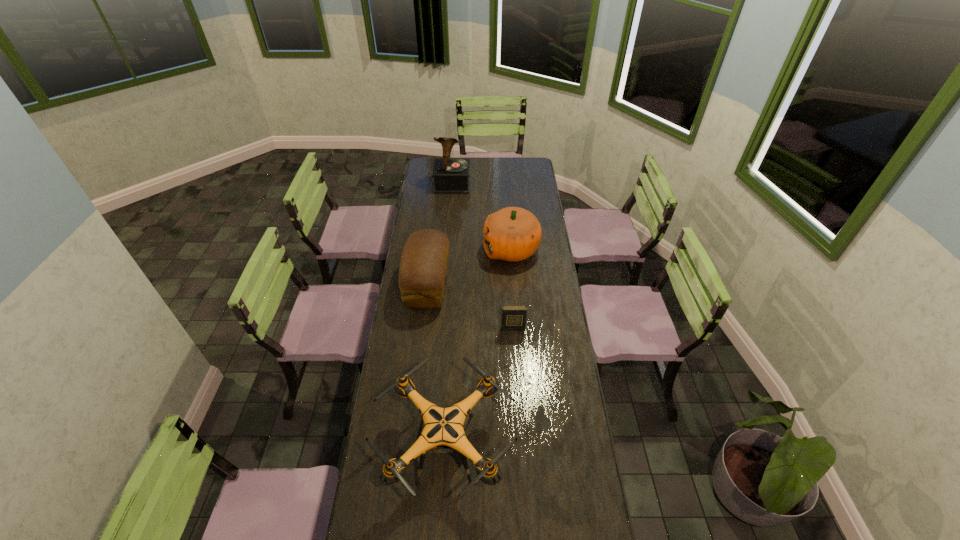
Image resolution: width=960 pixels, height=540 pixels. I want to click on vacant space at the far edge of the desktop, so click(490, 158).

You are a GUI agent. You are given a task and a screenshot of the screen. Output one action in this format:
    pyautogui.click(x=<x>, y=<y>)
    Task: Click on the free space at the left edge
    The width and height of the screenshot is (960, 540).
    Given the screenshot: What is the action you would take?
    pyautogui.click(x=434, y=194)

Image resolution: width=960 pixels, height=540 pixels. Identify the location of free space at the right edge of the desktop. (538, 293).

At what (x,y) coordinates should I click in order to perform the action: click on vacant space at the far right corner of the desktop. Please return your answer as a coordinate pair (x, y). This screenshot has width=960, height=540. Looking at the image, I should click on (532, 170).

In order to click on free spot between the nearest object and the bread in this screenshot , I will do `click(437, 366)`.

Find the location of a particular element. free area in between the fourth farthest object and the tallest object is located at coordinates (483, 256).

You are a GUI agent. You are given a task and a screenshot of the screen. Output one action in this format:
    pyautogui.click(x=<x>, y=<y>)
    Task: Click on the empty space between the pumpkin and the drone
    The width and height of the screenshot is (960, 540).
    Given the screenshot: What is the action you would take?
    pyautogui.click(x=479, y=349)

Identify the location of vacant area between the drone and the farthest object. (449, 316).

I want to click on free space between the bread and the pumpkin, so click(469, 267).

This screenshot has width=960, height=540. I want to click on free spot between the bread and the second nearest object, so click(x=470, y=306).